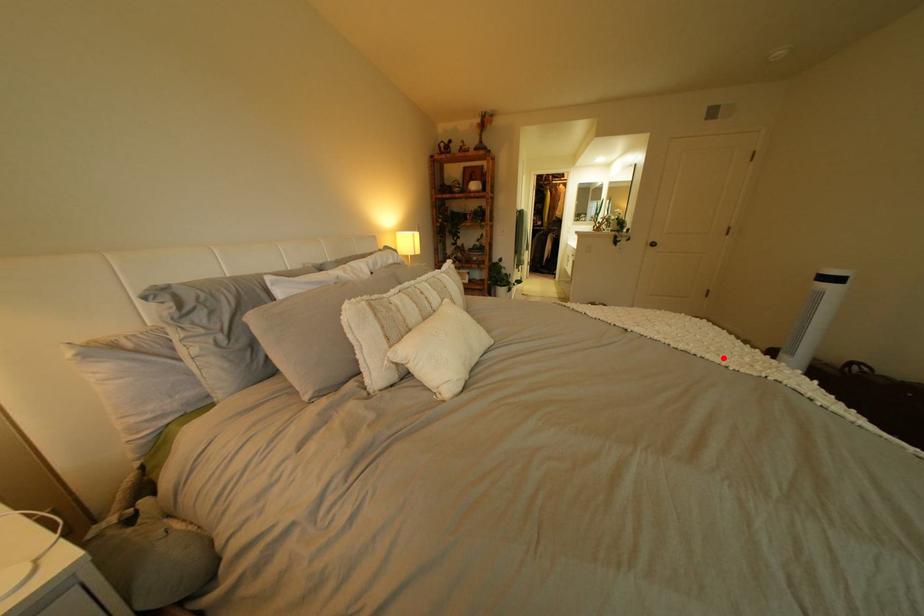
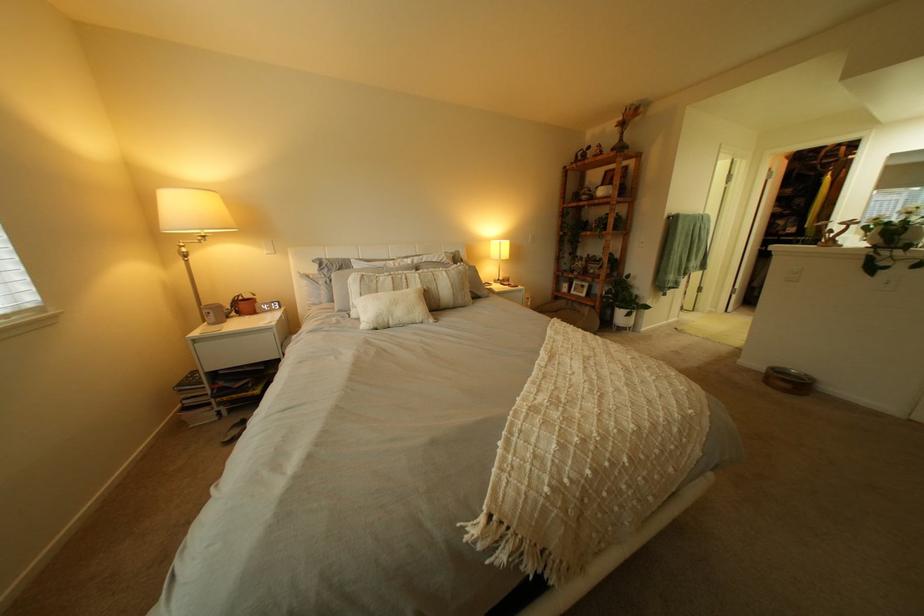
In the second image, find the point that corresponds to the highlighted location in the first image.

(541, 387)